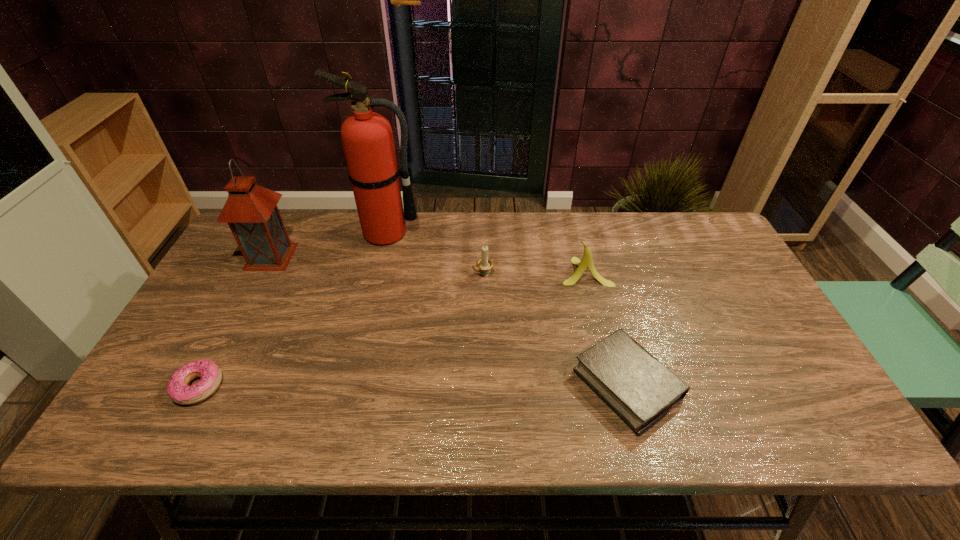
The image size is (960, 540). In order to click on vacant space that's between the fifth shortest object and the banana in this screenshot , I will do `click(428, 264)`.

Image resolution: width=960 pixels, height=540 pixels. Find the location of `unoccupied area between the fifth tallest object and the third object from right to left`. unoccupied area between the fifth tallest object and the third object from right to left is located at coordinates (555, 330).

Locate an element on the screen. Image resolution: width=960 pixels, height=540 pixels. vacant space that is in between the second tallest object and the fifth tallest object is located at coordinates (449, 321).

Locate an element on the screen. free space between the shortest object and the candle_holder is located at coordinates (341, 331).

I want to click on vacant point located between the shortest object and the fire extinguisher, so click(x=293, y=310).

Where is `free space between the banana and the doughnut`? The image size is (960, 540). free space between the banana and the doughnut is located at coordinates (392, 329).

Locate an element on the screen. This screenshot has width=960, height=540. unoccupied area between the doughnut and the candle_holder is located at coordinates (341, 331).

Locate an element on the screen. vacant area that lies between the fourth object from left to right and the Bible is located at coordinates (555, 330).

Identify which object is the fifth nearest to the lantern. Please provide its 2D coordinates. Your answer should be formatted as a tuple, i.e. [(x, y)], where the tuple contains the x and y coordinates of a point satisfying the conditions above.

[(641, 390)]

Image resolution: width=960 pixels, height=540 pixels. Identify the location of object that is the second nearest to the candle_holder. (367, 138).